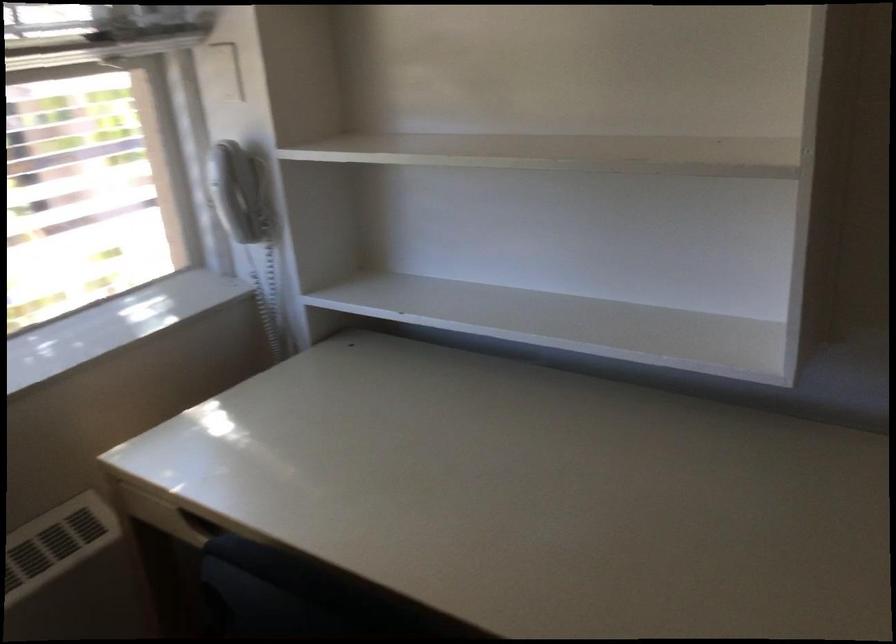
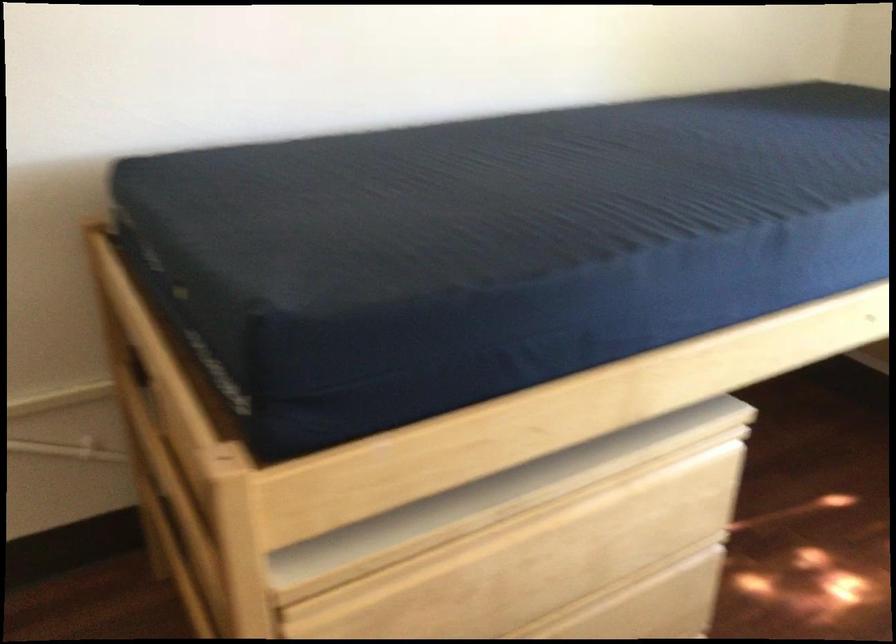
The first image is from the beginning of the video and the second image is from the end. How did the camera likely rotate when shooting the video?

The rotation direction of the camera is left-down.